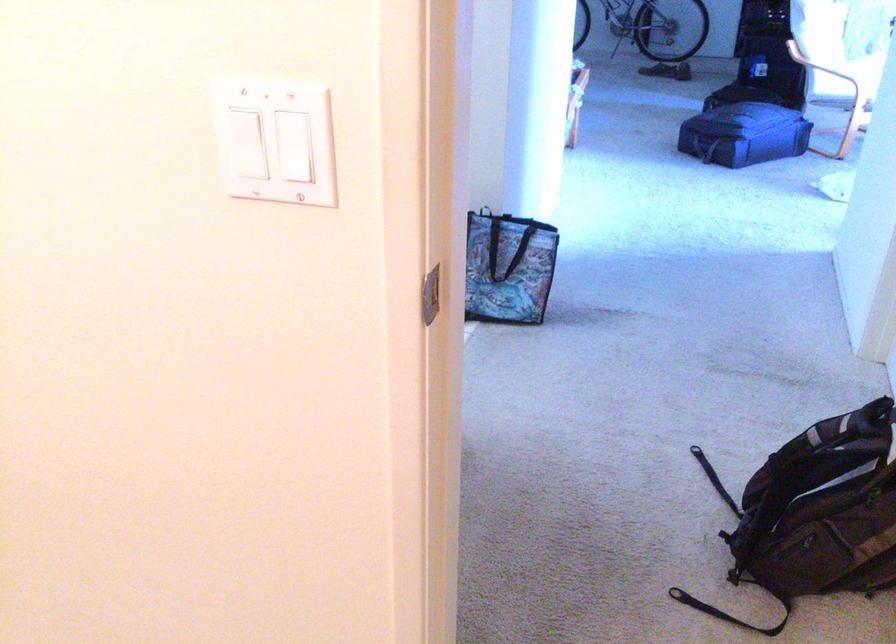
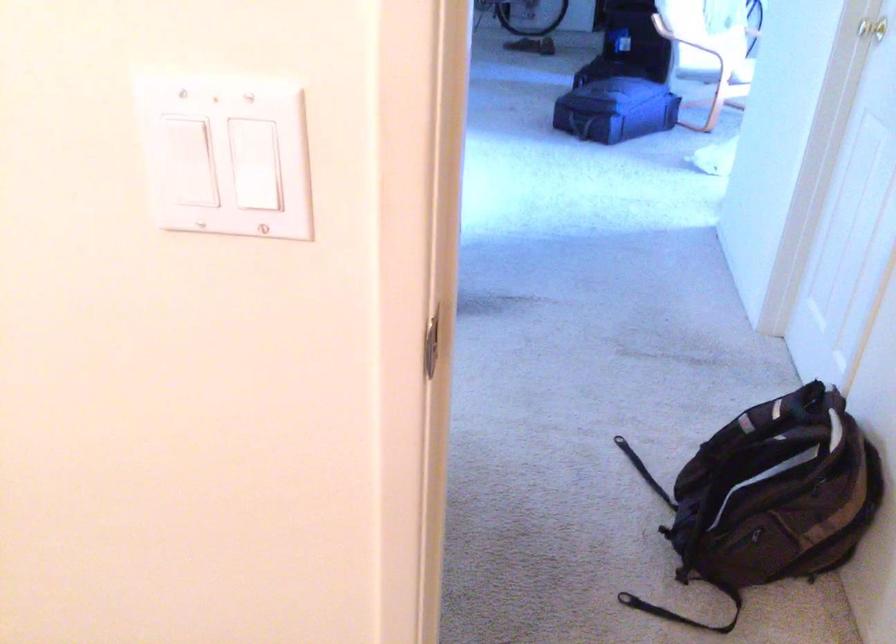
What movement of the cameraman would produce the second image?

The cameraman walked toward left, forward.